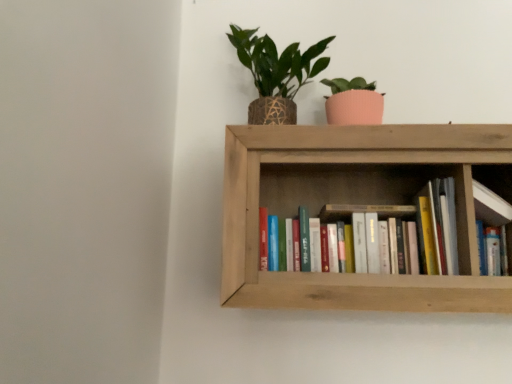
Locate an element on the screen. The image size is (512, 384). green woven pot at upper center is located at coordinates (276, 74).

Where is `green woven pot at upper center`? The width and height of the screenshot is (512, 384). green woven pot at upper center is located at coordinates (276, 74).

Considering the points (300, 63) and (273, 301), which point is in front, point (300, 63) or point (273, 301)?

The point (273, 301) is closer.

Between green woven pot at upper center and wooden bookshelf at center, which one has larger width?

Wider between the two is wooden bookshelf at center.

From a real-world perspective, does green woven pot at upper center sit lower than wooden bookshelf at center?

No, from a real-world perspective, green woven pot at upper center is not beneath wooden bookshelf at center.

Is green woven pot at upper center positioned before wooden bookshelf at center?

No, green woven pot at upper center is behind wooden bookshelf at center.

Is green woven pot at upper center not close to hardcover books at center?

green woven pot at upper center is actually quite close to hardcover books at center.

Which object is closer to the camera taking this photo, green woven pot at upper center or hardcover books at center?

hardcover books at center is more forward.

From the image's perspective, which one is positioned lower, green woven pot at upper center or hardcover books at center?

hardcover books at center is shown below in the image.

Who is bigger, green woven pot at upper center or wooden bookshelf at upper right?

With larger size is green woven pot at upper center.

Considering the relative positions of green woven pot at upper center and wooden bookshelf at upper right in the image provided, is green woven pot at upper center behind wooden bookshelf at upper right?

Yes, green woven pot at upper center is further from the viewer.

Is wooden bookshelf at upper right at the back of green woven pot at upper center?

green woven pot at upper center is not turned away from wooden bookshelf at upper right.

From the image's perspective, is green woven pot at upper center beneath wooden bookshelf at upper right?

No, from the image's perspective, green woven pot at upper center is not below wooden bookshelf at upper right.

Between hardcover books at center and wooden bookshelf at center, which one has less height?

With less height is hardcover books at center.

Which is in front, point (362, 197) or point (467, 151)?

Positioned in front is point (467, 151).

Does hardcover books at center come in front of wooden bookshelf at center?

No, it is not.

Locate an element on the screen. The width and height of the screenshot is (512, 384). book on the left of wooden bookshelf at center is located at coordinates (343, 195).

Which point is more distant from viewer, [343,218] or [481,202]?

The point [343,218] is behind.

Can you confirm if hardcover books at center is thinner than wooden bookshelf at upper right?

No, hardcover books at center is not thinner than wooden bookshelf at upper right.

From a real-world perspective, is hardcover books at center on wooden bookshelf at upper right?

Answer: Actually, hardcover books at center is physically below wooden bookshelf at upper right in the real world.

Is hardcover books at center looking in the opposite direction of wooden bookshelf at upper right?

No.

From the picture: Can you confirm if wooden bookshelf at upper right is taller than green woven pot at upper center?

No.

Measure the distance from wooden bookshelf at upper right to green woven pot at upper center.

They are 22.35 inches apart.

Looking at their sizes, would you say wooden bookshelf at upper right is wider or thinner than green woven pot at upper center?

In the image, wooden bookshelf at upper right appears to be more narrow than green woven pot at upper center.

From a real-world perspective, is wooden bookshelf at upper right below green woven pot at upper center?

Correct, in the physical world, wooden bookshelf at upper right is lower than green woven pot at upper center.

Is wooden bookshelf at center positioned far away from hardcover books at center?

No.

From the image's perspective, does wooden bookshelf at center appear higher than hardcover books at center?

Yes, from the image's perspective, wooden bookshelf at center is over hardcover books at center.

Who is shorter, wooden bookshelf at center or hardcover books at center?

With less height is hardcover books at center.

You are a GUI agent. You are given a task and a screenshot of the screen. Output one action in this format:
    pyautogui.click(x=<x>, y=<y>)
    Task: Click on the shelf that is under the green woven pot at upper center (from a real-world perspective)
    The height and width of the screenshot is (384, 512).
    Given the screenshot: What is the action you would take?
    pyautogui.click(x=357, y=203)

Image resolution: width=512 pixels, height=384 pixels. I want to click on houseplant that is behind the hardcover books at center, so click(x=276, y=74).

Estimate the real-world distances between objects in this image. Which object is further from hardcover books at center, green woven pot at upper center or wooden bookshelf at center?

Among the two, green woven pot at upper center is located further to hardcover books at center.

From the image, which object appears to be farther from hardcover books at center, wooden bookshelf at center or green woven pot at upper center?

Based on the image, green woven pot at upper center appears to be further to hardcover books at center.

Which object lies further to the anchor point hardcover books at center, wooden bookshelf at upper right or wooden bookshelf at center?

The object further to hardcover books at center is wooden bookshelf at upper right.

Looking at the image, which one is located further to wooden bookshelf at upper right, green woven pot at upper center or hardcover books at center?

Based on the image, green woven pot at upper center appears to be further to wooden bookshelf at upper right.

Based on their spatial positions, is wooden bookshelf at center or hardcover books at center closer to wooden bookshelf at upper right?

hardcover books at center lies closer to wooden bookshelf at upper right than the other object.

Which object lies nearer to the anchor point wooden bookshelf at center, hardcover books at center or wooden bookshelf at upper right?

hardcover books at center is closer to wooden bookshelf at center.

Consider the image. Estimate the real-world distances between objects in this image. Which object is closer to wooden bookshelf at center, hardcover books at center or green woven pot at upper center?

hardcover books at center is positioned closer to the anchor wooden bookshelf at center.

From the image, which object appears to be farther from wooden bookshelf at center, wooden bookshelf at upper right or hardcover books at center?

Based on the image, wooden bookshelf at upper right appears to be further to wooden bookshelf at center.

Where is `shelf between hardcover books at center and wooden bookshelf at upper right in the horizontal direction`? shelf between hardcover books at center and wooden bookshelf at upper right in the horizontal direction is located at coordinates (357, 203).

Image resolution: width=512 pixels, height=384 pixels. What are the coordinates of `book between green woven pot at upper center and wooden bookshelf at upper right from left to right` in the screenshot? It's located at (343, 195).

At what (x,y) coordinates should I click in order to perform the action: click on shelf that lies between green woven pot at upper center and hardcover books at center from top to bottom. Please return your answer as a coordinate pair (x, y). This screenshot has height=384, width=512. Looking at the image, I should click on (357, 203).

Locate an element on the screen. shelf between green woven pot at upper center and wooden bookshelf at upper right from left to right is located at coordinates (357, 203).